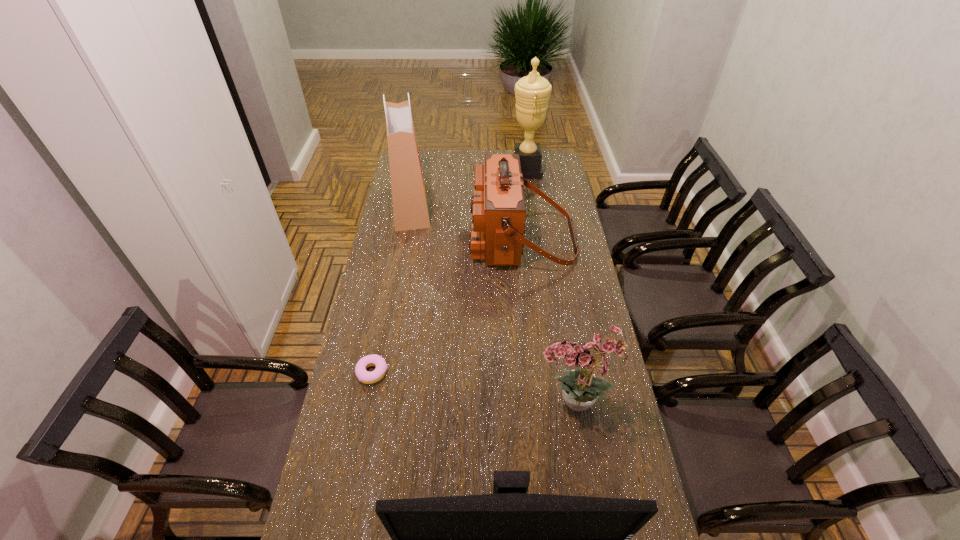
This screenshot has height=540, width=960. Identify the location of flower arrangement positioned at the right edge. (581, 387).

The width and height of the screenshot is (960, 540). What are the coordinates of `satchel at the right edge` in the screenshot? It's located at (498, 209).

At what (x,y) coordinates should I click in order to perform the action: click on object that is at the far right corner. Please return your answer as a coordinate pair (x, y). The width and height of the screenshot is (960, 540). Looking at the image, I should click on (532, 92).

I want to click on vacant space at the left edge of the desktop, so click(324, 491).

Where is `vacant area at the right edge`? Image resolution: width=960 pixels, height=540 pixels. vacant area at the right edge is located at coordinates pos(561,266).

The image size is (960, 540). In the image, there is a desktop. What are the coordinates of `vacant space at the far left corner` in the screenshot? It's located at (421, 159).

Find the location of `free space at the far right corner`. free space at the far right corner is located at coordinates (543, 171).

The width and height of the screenshot is (960, 540). What are the coordinates of `vacant region between the doughnut and the shopping bag` in the screenshot? It's located at (392, 289).

I want to click on vacant space that's between the trophy cup and the doughnut, so click(449, 271).

Where is `unoccupied area between the flower arrangement and the trophy cup`? Image resolution: width=960 pixels, height=540 pixels. unoccupied area between the flower arrangement and the trophy cup is located at coordinates pyautogui.click(x=550, y=288).